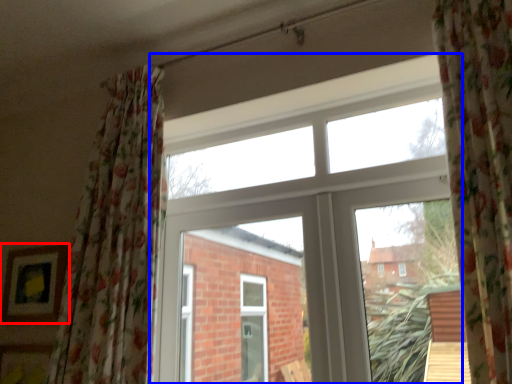
Question: Which point is further to the camera, picture frame (highlighted by a red box) or window (highlighted by a blue box)?

Choices:
 (A) picture frame
 (B) window

Answer: (A)